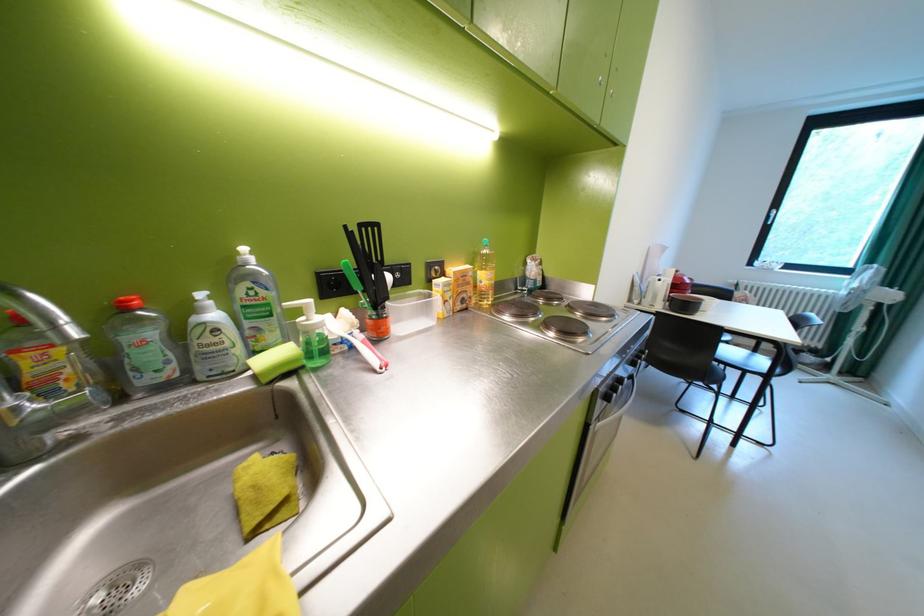
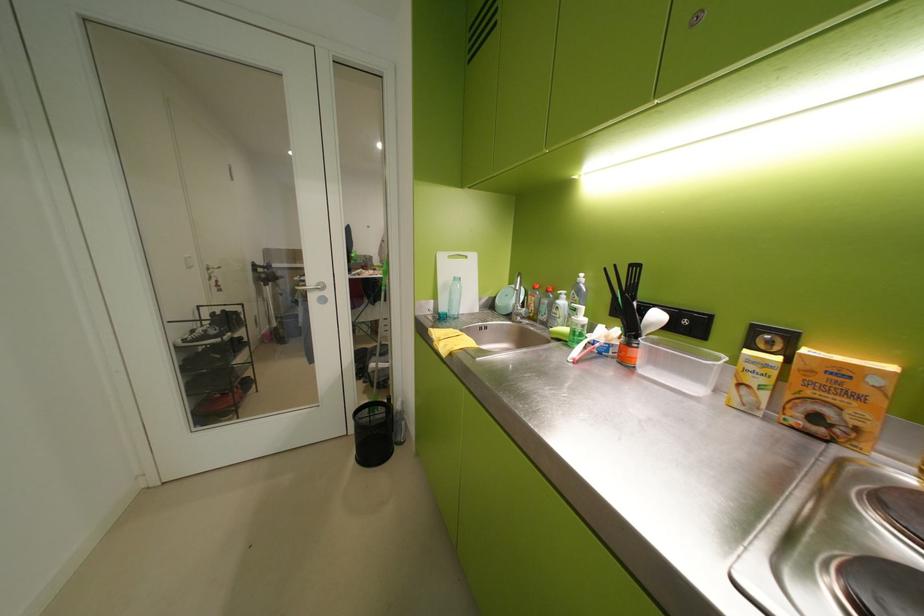
In the second image, find the point that corresponds to the point at 475,275 in the first image.

(852, 373)